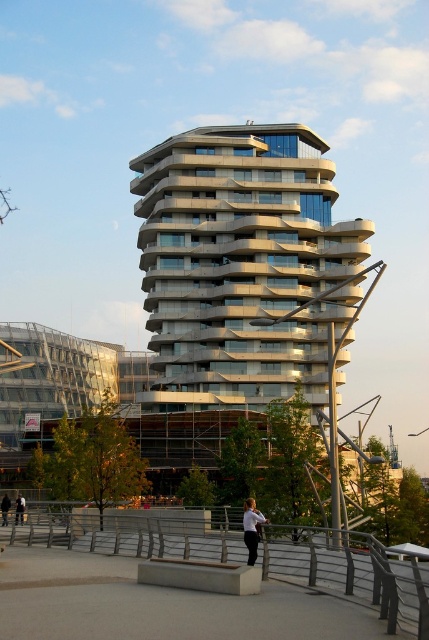
Does white fabric shirt at center lie in front of dark gray jacket at lower center?

Yes, white fabric shirt at center is in front of dark gray jacket at lower center.

Does point (257, 513) come closer to viewer compared to point (2, 515)?

That is True.

This screenshot has height=640, width=429. Identify the location of white fabric shirt at center. (251, 529).

Is point (202, 355) behind point (242, 515)?

Yes, point (202, 355) is farther from viewer.

Between point (251, 323) and point (250, 506), which one is positioned in front?

Point (250, 506) is more forward.

At what (x,y) coordinates should I click in order to perform the action: click on metallic glass tower at center. Please return your answer as a coordinate pair (x, y). Looking at the image, I should click on (241, 264).

Consider the image. Is metal/textured rail at lower center to the right of white fabric shirt at center from the viewer's perspective?

No, metal/textured rail at lower center is not to the right of white fabric shirt at center.

Which is more to the left, metal/textured rail at lower center or white fabric shirt at center?

From the viewer's perspective, metal/textured rail at lower center appears more on the left side.

Measure the distance between metal/textured rail at lower center and camera.

18.99 meters

Where is `metal/textured rail at lower center`? The height and width of the screenshot is (640, 429). metal/textured rail at lower center is located at coordinates (350, 570).